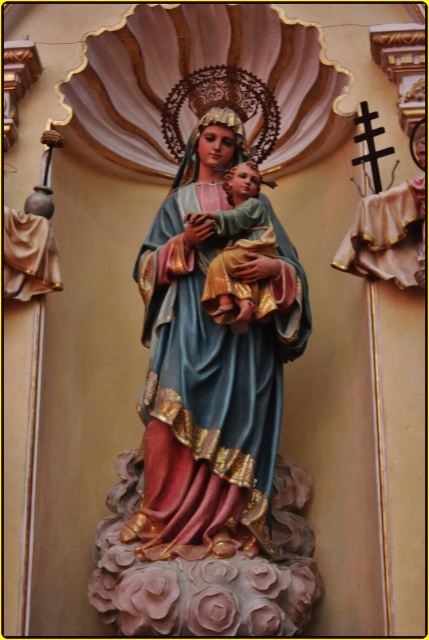
What are the coordinates of the polychrome wood statue of madonna and child at center?

The polychrome wood statue of madonna and child at center is located at coordinates point (210, 371).

You are an art restorer examining the religious statue. You need to clean the polychrome wood statue of madonna and child at center and the gold textured fabric at center. Which object should you start with if you want to work on the closest item first?

The polychrome wood statue of madonna and child at center is closer to the viewer than the gold textured fabric at center, so you should start cleaning the polychrome wood statue of madonna and child at center first.